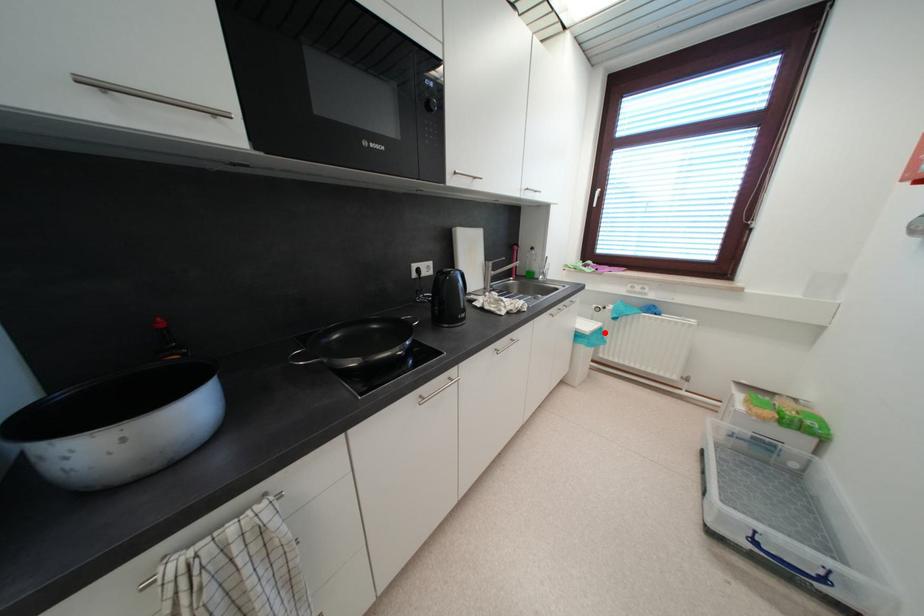
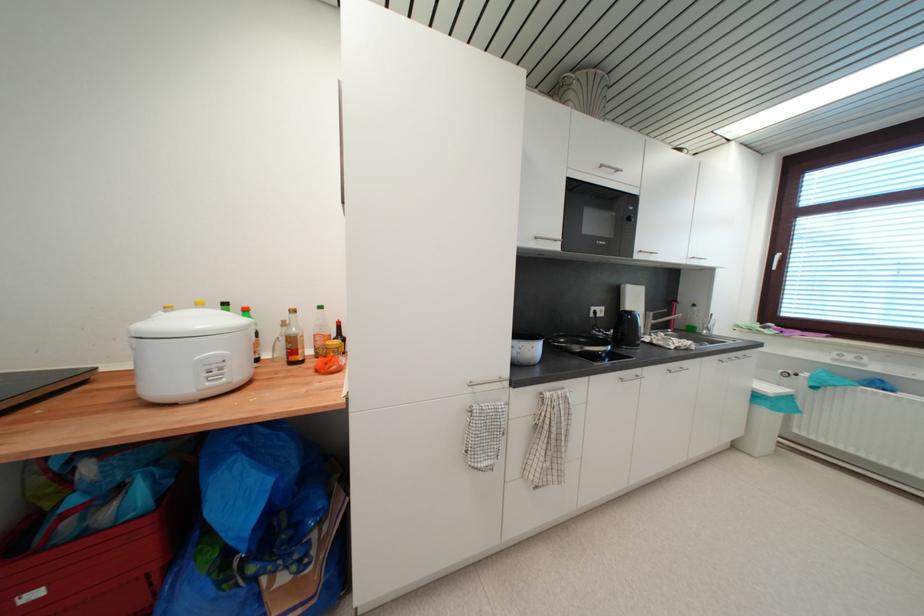
Find the pixel in the second image that matches the highlighted location in the first image.

(795, 400)